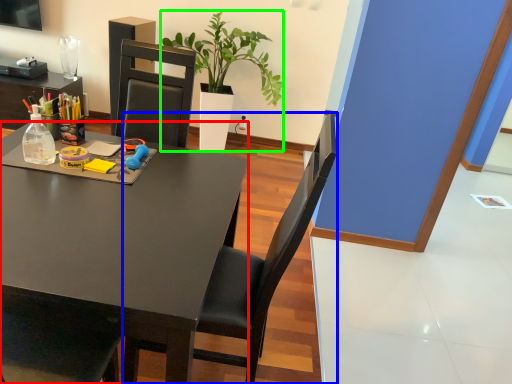
Question: Which is farther away from desk (highlighted by a red box)? chair (highlighted by a blue box) or houseplant (highlighted by a green box)?

Choices:
 (A) chair
 (B) houseplant

Answer: (B)